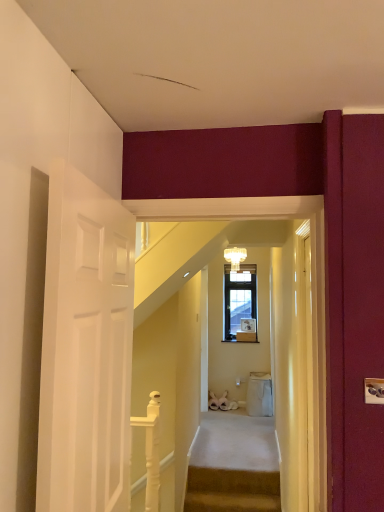
Question: From a real-world perspective, is carpeted stairs at center, the 1th stairs in the front-to-back sequence, positioned above or below beige fabric trash bin at lower center?

Choices:
 (A) above
 (B) below

Answer: (B)

Question: Visually, is carpeted stairs at center, positioned as the 1th stairs in bottom-to-top order, positioned to the left or to the right of beige fabric trash bin at lower center?

Choices:
 (A) left
 (B) right

Answer: (A)

Question: Considering the real-world distances, which object is farthest from the crystal glass chandelier at upper center?

Choices:
 (A) white glossy balustrade at lower center
 (B) wooden frame at center
 (C) carpeted stairs at center, positioned as the second stairs in back-to-front order
 (D) beige fabric trash bin at lower center
 (E) white carpeted stairs at center, arranged as the 1th stairs when viewed from the top

Answer: (A)

Question: Which is nearer to the white carpeted stairs at center, the first stairs when ordered from back to front?

Choices:
 (A) carpeted stairs at center, positioned as the 1th stairs in bottom-to-top order
 (B) crystal glass chandelier at upper center
 (C) wooden frame at center
 (D) white glossy balustrade at lower center
 (E) beige fabric trash bin at lower center

Answer: (A)